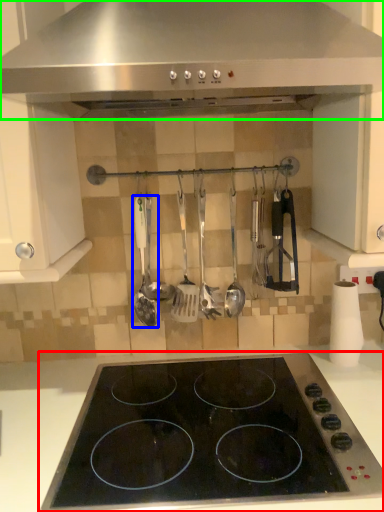
Question: Which object is positioned closest to gas stove (highlighted by a red box)? Select from spatula (highlighted by a blue box) and kitchen appliance (highlighted by a green box).

Choices:
 (A) spatula
 (B) kitchen appliance

Answer: (A)